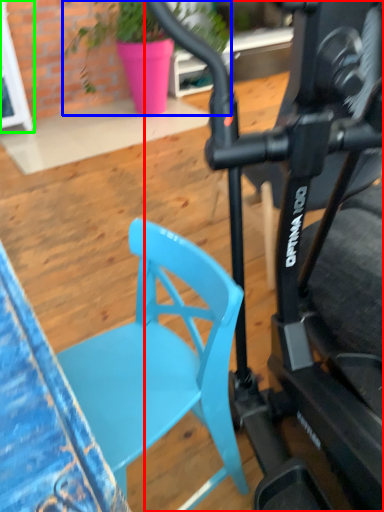
Question: Which object is the farthest from bicycle (highlighted by a red box)? Choose among these: houseplant (highlighted by a blue box) or glass door (highlighted by a green box).

Choices:
 (A) houseplant
 (B) glass door

Answer: (B)